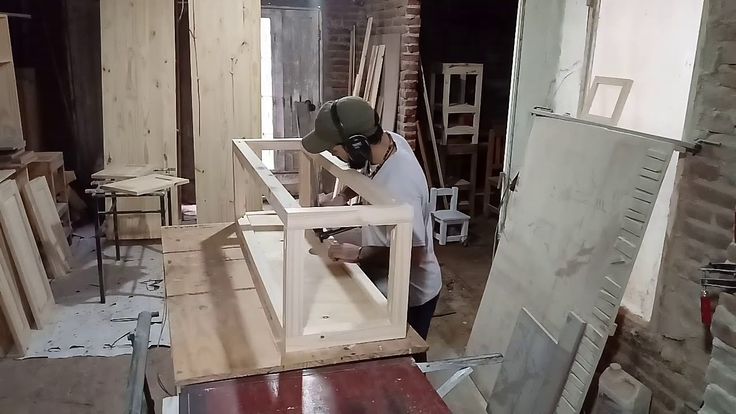
At what (x,y) coordinates should I click in order to perform the action: click on blanket. Please return your answer as a coordinate pair (x, y). Looking at the image, I should click on (85, 330).